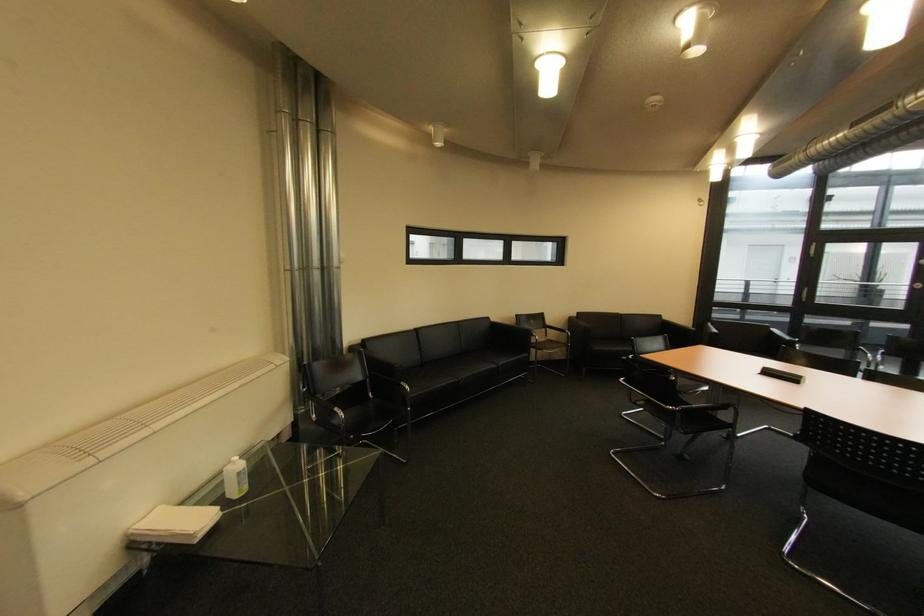
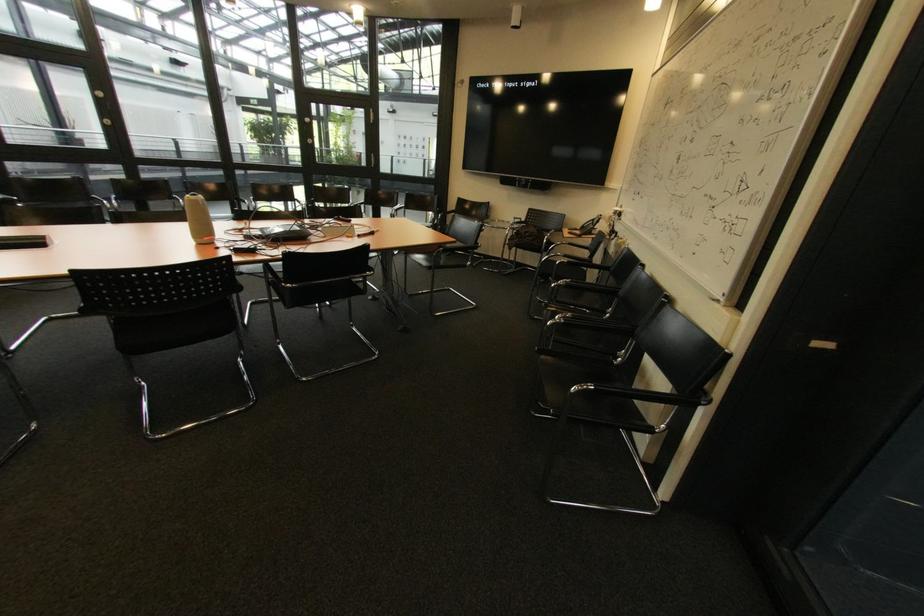
How did the camera likely rotate?

The camera's rotation is toward right-down.